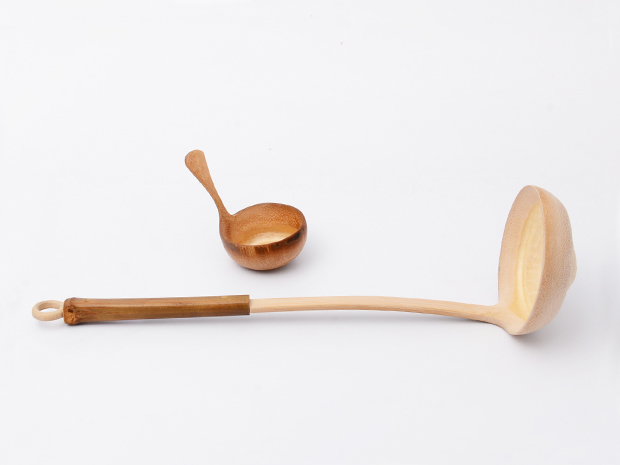
You are a GUI agent. You are given a task and a screenshot of the screen. Output one action in this format:
    pyautogui.click(x=<x>, y=<y>)
    Task: Click on the light wooden handle section
    
    Given the screenshot: What is the action you would take?
    pyautogui.click(x=339, y=304)